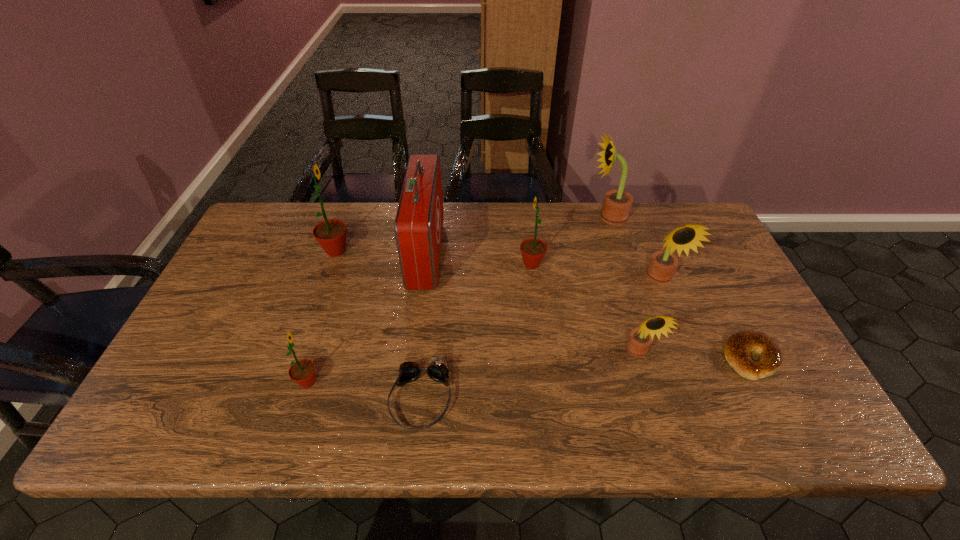
Locate an element on the screen. free region located 0.300m on the face of the third sunflower from left to right is located at coordinates (418, 264).

Identify the location of vacant space located on the face of the third sunflower from left to right. Image resolution: width=960 pixels, height=540 pixels. (451, 264).

Image resolution: width=960 pixels, height=540 pixels. I want to click on vacant space located 0.140m on the face of the third sunflower from left to right, so click(471, 264).

Image resolution: width=960 pixels, height=540 pixels. What are the coordinates of `free space located on the face of the second smallest yellow sunflower` in the screenshot? It's located at pos(691,355).

Where is `vacant space located on the face of the nearest sunflower`? vacant space located on the face of the nearest sunflower is located at coordinates [x=372, y=382].

Locate an element on the screen. The width and height of the screenshot is (960, 540). blank space located 0.150m on the face of the fifth farthest sunflower is located at coordinates coord(660,424).

You are a GUI agent. You are given a task and a screenshot of the screen. Output one action in this format:
    pyautogui.click(x=<x>, y=<y>)
    Task: Click on the vacant space located on the front of the rightmost object
    
    Given the screenshot: What is the action you would take?
    pyautogui.click(x=788, y=431)

Identify the location of the first-aid kit present at the far edge. This screenshot has height=540, width=960. (418, 225).

The image size is (960, 540). I want to click on object located in the near edge section of the desktop, so click(x=438, y=370).

Find the location of a particular element. object that is at the right edge is located at coordinates (737, 349).